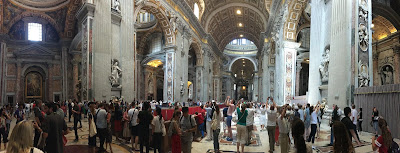
Where is `curtain`? This screenshot has height=153, width=400. curtain is located at coordinates (390, 104).